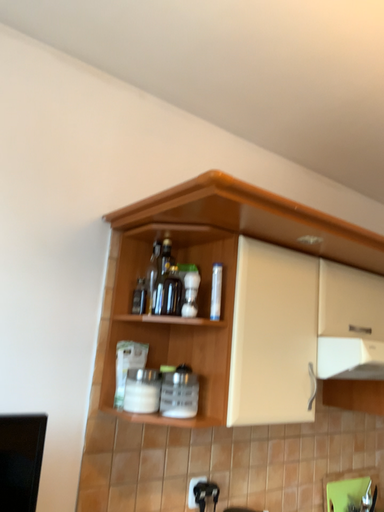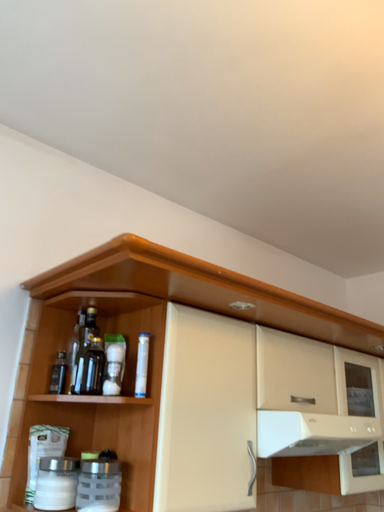
Question: How did the camera likely rotate when shooting the video?

Choices:
 (A) rotated upward
 (B) rotated downward

Answer: (A)